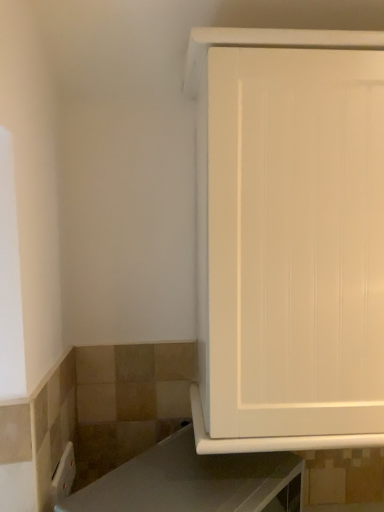
Question: From the image's perspective, relative to white matte cabinet at upper right, is white glossy countertop at lower right above or below?

Choices:
 (A) above
 (B) below

Answer: (B)

Question: Is point (221, 497) closer or farther from the camera than point (357, 67)?

Choices:
 (A) closer
 (B) farther

Answer: (A)

Question: From their relative heights in the image, would you say white glossy countertop at lower right is taller or shorter than white matte cabinet at upper right?

Choices:
 (A) tall
 (B) short

Answer: (B)

Question: Looking at their shapes, would you say white matte cabinet at upper right is wider or thinner than white glossy countertop at lower right?

Choices:
 (A) thin
 (B) wide

Answer: (B)

Question: From the image's perspective, relative to white glossy countertop at lower right, is white matte cabinet at upper right above or below?

Choices:
 (A) below
 (B) above

Answer: (B)

Question: Is white matte cabinet at upper right to the left or to the right of white glossy countertop at lower right in the image?

Choices:
 (A) left
 (B) right

Answer: (B)

Question: From a real-world perspective, is white matte cabinet at upper right physically located above or below white glossy countertop at lower right?

Choices:
 (A) above
 (B) below

Answer: (A)